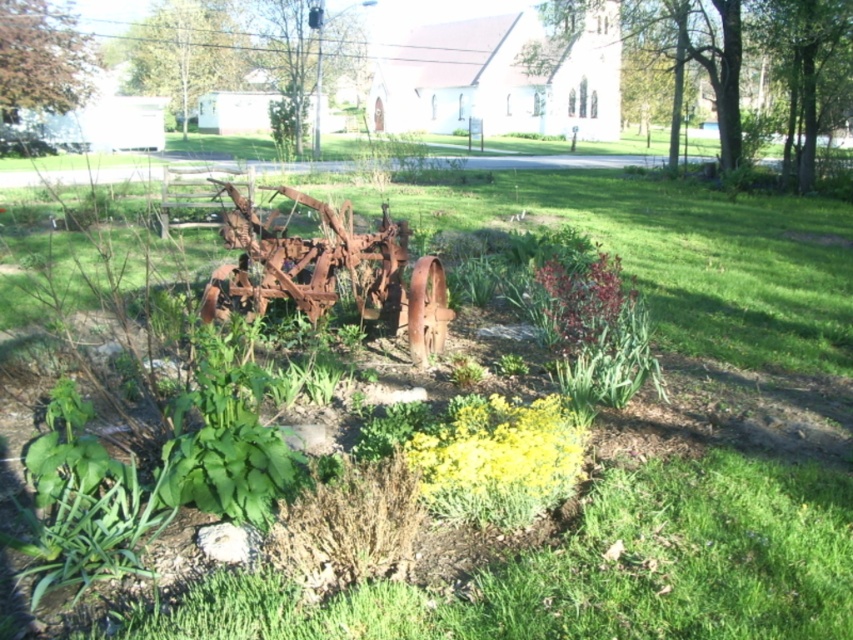
Who is shorter, yellow matte flower at center or shiny red leaves at center?

yellow matte flower at center is shorter.

Image resolution: width=853 pixels, height=640 pixels. What do you see at coordinates (498, 458) in the screenshot?
I see `yellow matte flower at center` at bounding box center [498, 458].

The width and height of the screenshot is (853, 640). I want to click on yellow matte flower at center, so click(x=498, y=458).

Does rusty metal tractor at center appear on the right side of shiny red leaves at center?

Incorrect, rusty metal tractor at center is not on the right side of shiny red leaves at center.

Does point (241, 228) come behind point (624, 298)?

Yes, it is behind point (624, 298).

Identify the location of rusty metal tractor at center. (328, 269).

Does rusty metal tractor at center appear on the right side of yellow matte flower at center?

In fact, rusty metal tractor at center is to the left of yellow matte flower at center.

Is rusty metal tractor at center shorter than yellow matte flower at center?

In fact, rusty metal tractor at center may be taller than yellow matte flower at center.

Does point (386, 228) lie behind point (541, 458)?

Yes, it is.

Where is `rusty metal tractor at center`? Image resolution: width=853 pixels, height=640 pixels. rusty metal tractor at center is located at coordinates (328, 269).